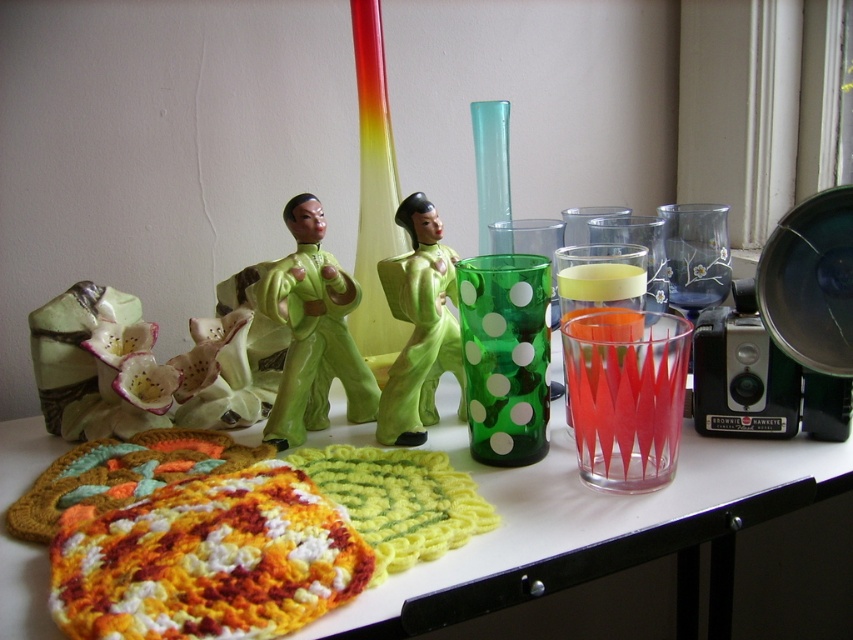
Does knitted fabric placemat at center have a smaller size compared to green matte figure at center?

Actually, knitted fabric placemat at center might be larger than green matte figure at center.

Image resolution: width=853 pixels, height=640 pixels. What are the coordinates of `knitted fabric placemat at center` in the screenshot? It's located at (589, 515).

Is point (4, 545) farther from camera compared to point (291, 372)?

No, (4, 545) is in front of (291, 372).

Find the location of a particular element. This screenshot has width=853, height=640. knitted fabric placemat at center is located at coordinates (589, 515).

Is knitted fabric placemat at center below green glossy figurine at center?

Correct, knitted fabric placemat at center is located below green glossy figurine at center.

Can you confirm if knitted fabric placemat at center is thinner than green glossy figurine at center?

No, knitted fabric placemat at center is not thinner than green glossy figurine at center.

Who is more forward, (798, 456) or (431, 340)?

Point (798, 456) is more forward.

Locate an element on the screen. Image resolution: width=853 pixels, height=640 pixels. knitted fabric placemat at center is located at coordinates (589, 515).

Is point (708, 468) farther from camera compared to point (637, 444)?

Yes.

Is knitted fabric placemat at center to the right of translucent red glass at center right from the viewer's perspective?

Incorrect, knitted fabric placemat at center is not on the right side of translucent red glass at center right.

Who is more forward, (438, 561) or (616, 324)?

Point (438, 561)

Find the location of a particular element. This screenshot has height=640, width=853. knitted fabric placemat at center is located at coordinates (589, 515).